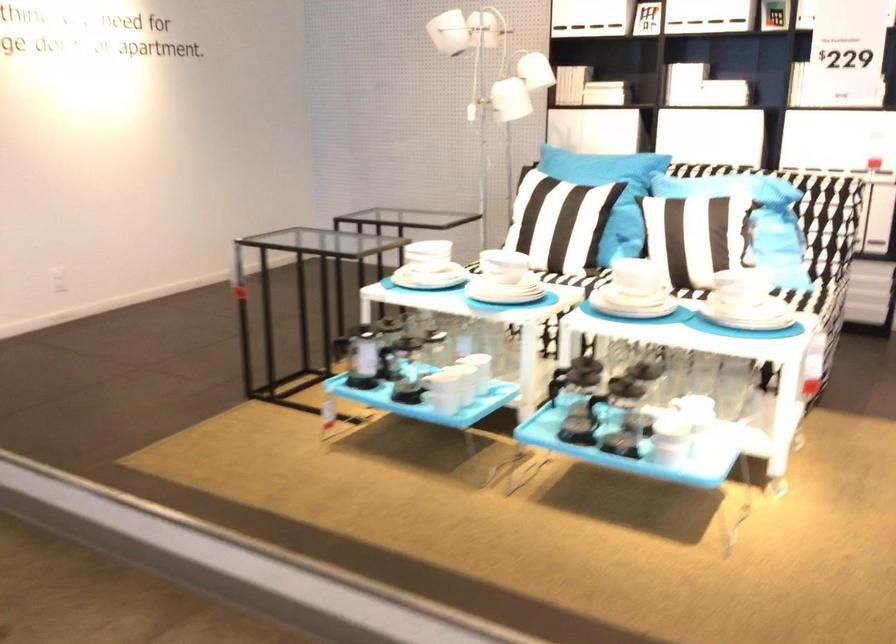
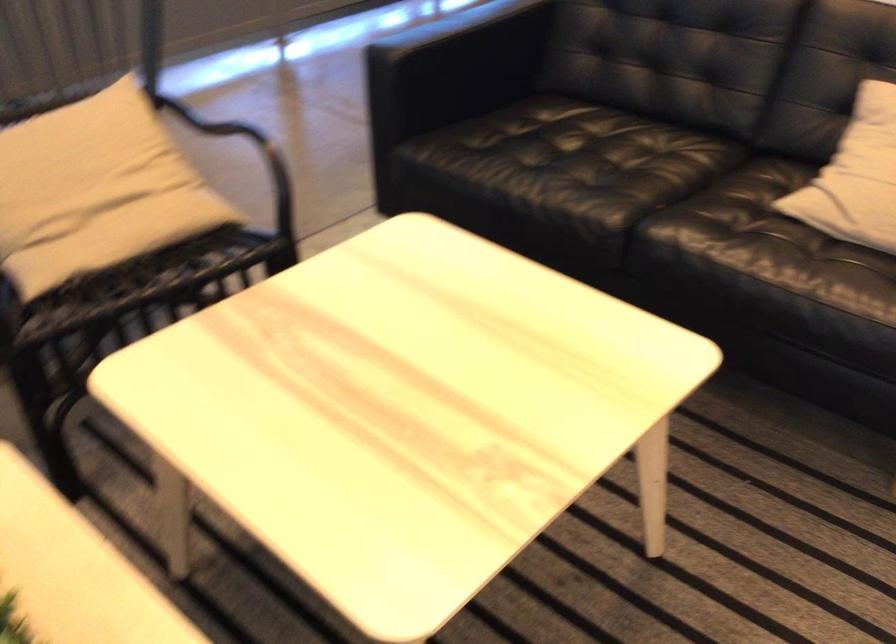
The images are taken continuously from a first-person perspective. In which direction is your viewpoint rotating?

The camera rotated toward left-down.